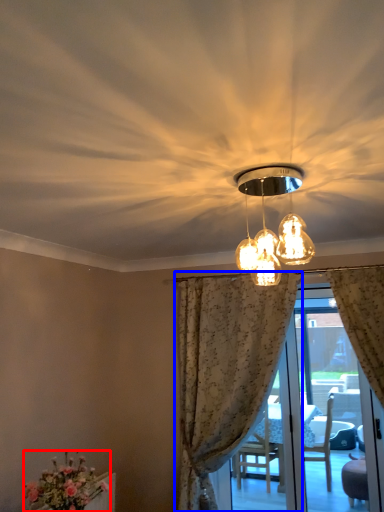
Question: Which point is further to the camera, flower (highlighted by a red box) or curtain (highlighted by a blue box)?

Choices:
 (A) flower
 (B) curtain

Answer: (B)